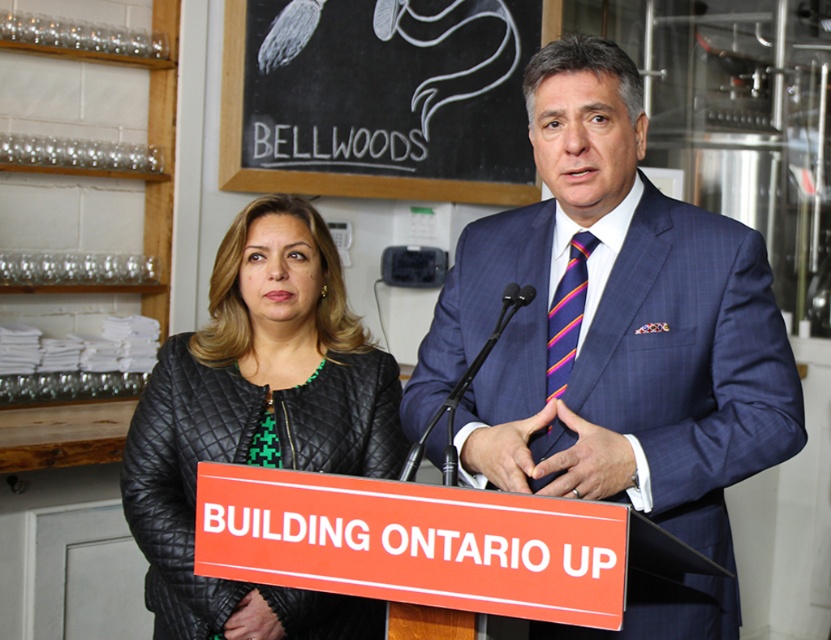
You are standing in the room where the podium is located. There are two points marked in the image. Which point, point (738, 611) or point (289, 419), is closer to you?

Point (738, 611) is closer to the viewer than point (289, 419).

You are an event planner arranging a conference. You need to ensure that the orange plastic sign at center and the striped silk tie at center are visible to the audience. Which object should be placed closer to the front to ensure visibility?

The orange plastic sign at center should be placed closer to the front because its width is larger than the striped silk tie at center, making it more visible from a distance.